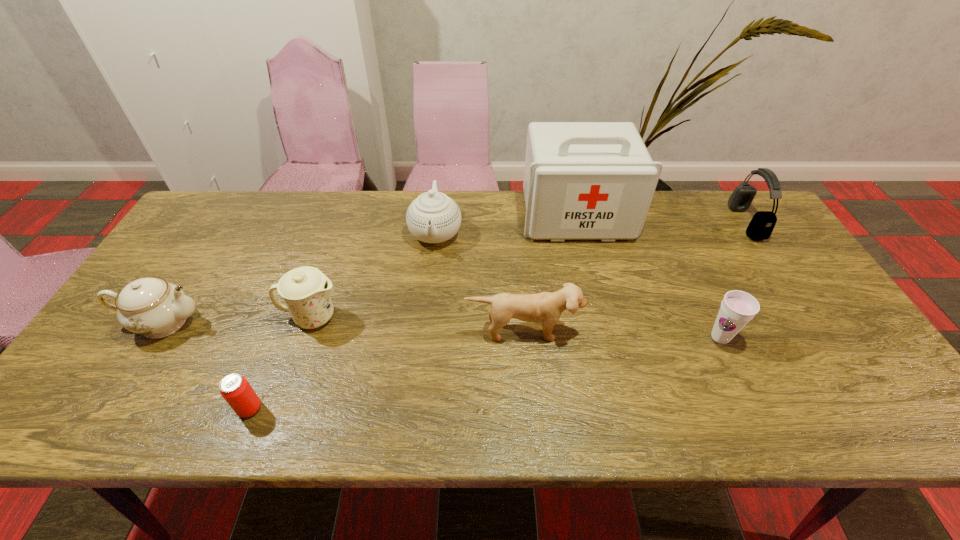
Find the location of a particular element. the first-aid kit at the far edge is located at coordinates (583, 180).

Locate an element on the screen. The width and height of the screenshot is (960, 540). headset that is at the far edge is located at coordinates [x=762, y=224].

This screenshot has height=540, width=960. Identify the location of chinaware that is positioned at the far edge. (433, 217).

Locate an element on the screen. This screenshot has height=540, width=960. object at the near edge is located at coordinates (235, 389).

This screenshot has width=960, height=540. I want to click on object situated at the left edge, so click(x=152, y=307).

The height and width of the screenshot is (540, 960). Identify the location of object that is at the right edge. (762, 224).

The width and height of the screenshot is (960, 540). In order to click on object located in the far right corner section of the desktop in this screenshot , I will do `click(762, 224)`.

Find the location of a particular element. The height and width of the screenshot is (540, 960). free region at the far edge of the desktop is located at coordinates (509, 210).

Where is `vacant space at the near edge of the desktop`? The image size is (960, 540). vacant space at the near edge of the desktop is located at coordinates (726, 411).

In the image, there is a desktop. At what (x,y) coordinates should I click in order to perform the action: click on vacant space at the left edge. Please return your answer as a coordinate pair (x, y). The width and height of the screenshot is (960, 540). Looking at the image, I should click on (203, 241).